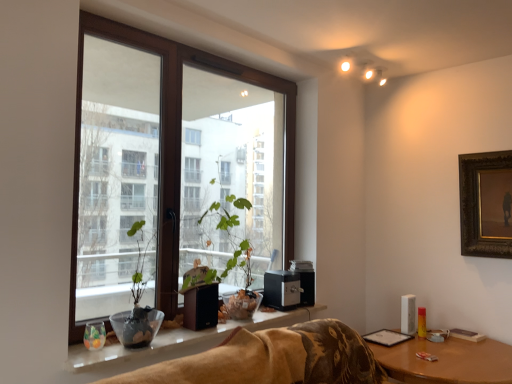
Question: From a real-world perspective, relative to green matte plant at center, is white glossy window sill at lower center vertically above or below?

Choices:
 (A) below
 (B) above

Answer: (A)

Question: Does point (193, 349) appear closer or farther from the camera than point (117, 327)?

Choices:
 (A) farther
 (B) closer

Answer: (B)

Question: Which object is positioned farthest from the brown wooden window at center?

Choices:
 (A) white glossy window sill at lower center
 (B) green matte plant at center
 (C) brown wooden table at lower right
 (D) gold-framed painting at upper right

Answer: (D)

Question: Which of these objects is positioned closest to the brown wooden window at center?

Choices:
 (A) brown wooden table at lower right
 (B) gold-framed painting at upper right
 (C) green matte plant at center
 (D) white glossy window sill at lower center

Answer: (D)